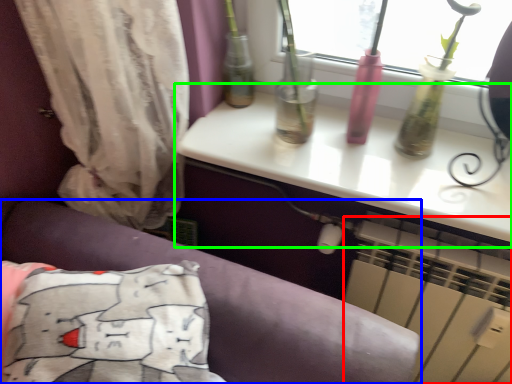
Question: Based on their relative distances, which object is nearer to air conditioning (highlighted by a red box)? Choose from furniture (highlighted by a blue box) and table (highlighted by a green box).

Choices:
 (A) furniture
 (B) table

Answer: (B)